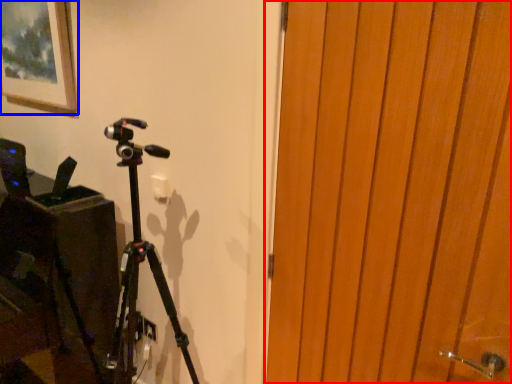
Question: Which point is further to the camera, door (highlighted by a red box) or picture frame (highlighted by a blue box)?

Choices:
 (A) door
 (B) picture frame

Answer: (B)